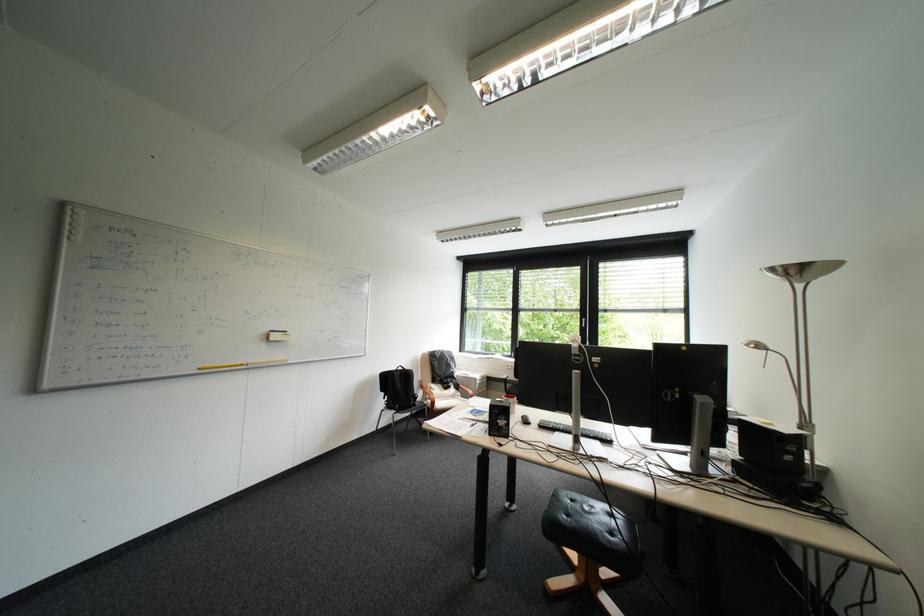
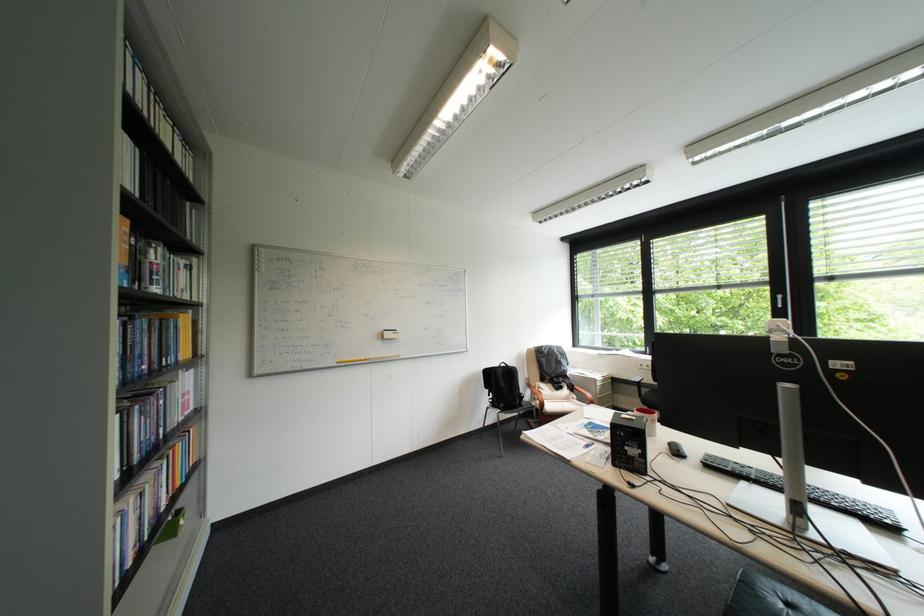
The point at (569, 434) is marked in the first image. Where is the corresponding point in the second image?

(757, 484)